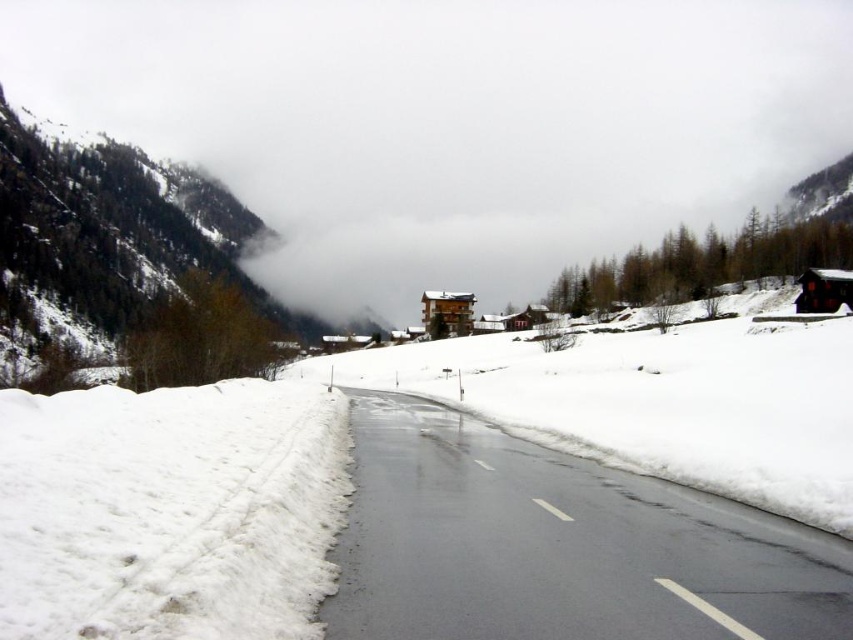
The image size is (853, 640). What do you see at coordinates (450, 124) in the screenshot?
I see `white fluffy cloud at upper center` at bounding box center [450, 124].

Between point (498, 116) and point (273, 348), which one is positioned behind?

The point (498, 116) is more distant.

Does point (747, 58) come closer to viewer compared to point (99, 214)?

No.

You are a GUI agent. You are given a task and a screenshot of the screen. Output one action in this format:
    pyautogui.click(x=<x>, y=<y>)
    Task: Click on the white fluffy cloud at upper center
    
    Given the screenshot: What is the action you would take?
    pyautogui.click(x=450, y=124)

Who is higher up, black asphalt road at center or snowy forested mountain at left?

Positioned higher is snowy forested mountain at left.

Who is more distant from viewer, (358,637) or (51,250)?

Point (51,250)

Locate an element on the screen. This screenshot has width=853, height=640. black asphalt road at center is located at coordinates (558, 545).

Does white fluffy cloud at upper center lie in front of white fluffy snow at lower left?

No, it is not.

Looking at this image, is white fluffy cloud at upper center shorter than white fluffy snow at lower left?

In fact, white fluffy cloud at upper center may be taller than white fluffy snow at lower left.

Is point (308, 292) positioned after point (158, 570)?

Yes.

Identify the location of white fluffy cloud at upper center. This screenshot has height=640, width=853. (450, 124).